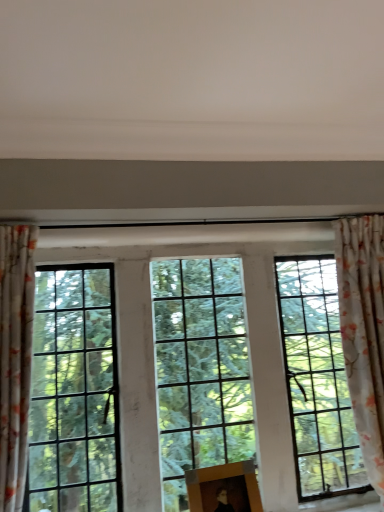
Question: Considering the relative positions of wooden picture frame at center and floral fabric curtain at right, positioned as the first curtain in right-to-left order, in the image provided, is wooden picture frame at center to the left of floral fabric curtain at right, positioned as the first curtain in right-to-left order, from the viewer's perspective?

Choices:
 (A) no
 (B) yes

Answer: (B)

Question: Can you confirm if wooden picture frame at center is positioned to the right of floral fabric curtain at right, which appears as the second curtain when viewed from the left?

Choices:
 (A) yes
 (B) no

Answer: (B)

Question: Would you say wooden picture frame at center is outside floral fabric curtain at right, marked as the first curtain in a back-to-front arrangement?

Choices:
 (A) no
 (B) yes

Answer: (B)

Question: Is wooden picture frame at center wider than floral fabric curtain at right, which appears as the second curtain when viewed from the left?

Choices:
 (A) yes
 (B) no

Answer: (B)

Question: Is wooden picture frame at center shorter than floral fabric curtain at right, marked as the first curtain in a back-to-front arrangement?

Choices:
 (A) yes
 (B) no

Answer: (A)

Question: Is wooden picture frame at center next to floral fabric curtain at right, which appears as the second curtain when viewed from the left, and touching it?

Choices:
 (A) yes
 (B) no

Answer: (B)

Question: Does wooden picture frame at center have a lesser width compared to floral fabric curtain at left, positioned as the first curtain in front-to-back order?

Choices:
 (A) yes
 (B) no

Answer: (A)

Question: Is wooden picture frame at center bigger than floral fabric curtain at left, the second curtain positioned from the right?

Choices:
 (A) no
 (B) yes

Answer: (A)

Question: Is wooden picture frame at center wider than floral fabric curtain at left, positioned as the first curtain in left-to-right order?

Choices:
 (A) yes
 (B) no

Answer: (B)

Question: Can we say wooden picture frame at center lies outside floral fabric curtain at left, positioned as the first curtain in left-to-right order?

Choices:
 (A) no
 (B) yes

Answer: (B)

Question: Can you confirm if wooden picture frame at center is positioned to the left of floral fabric curtain at left, positioned as the first curtain in left-to-right order?

Choices:
 (A) no
 (B) yes

Answer: (A)

Question: From the image's perspective, would you say wooden picture frame at center is positioned over floral fabric curtain at left, positioned as the first curtain in front-to-back order?

Choices:
 (A) no
 (B) yes

Answer: (A)

Question: Are clear glass window at center and wooden picture frame at center beside each other?

Choices:
 (A) no
 (B) yes

Answer: (A)